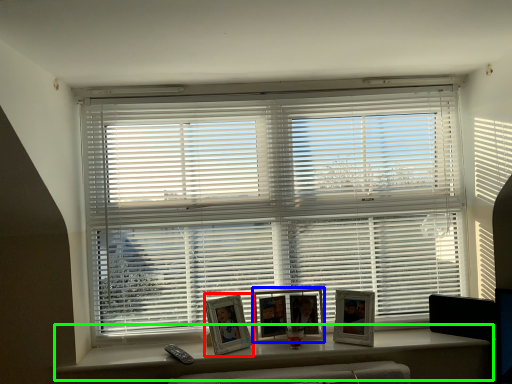
Question: Which object is positioned closest to picture frame (highlighted by a red box)? Select from picture frame (highlighted by a blue box) and window (highlighted by a green box).

Choices:
 (A) picture frame
 (B) window

Answer: (A)